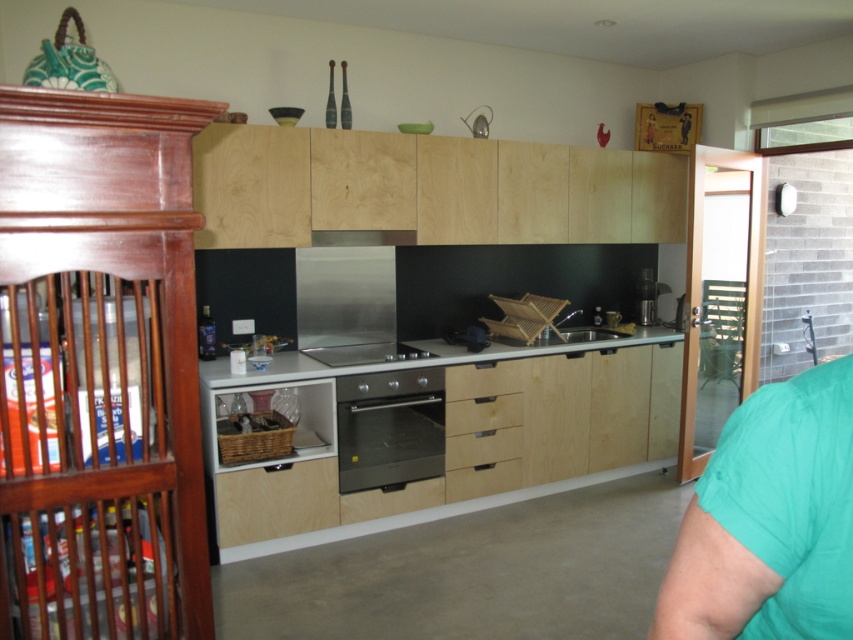
From the picture: Does light wood drawer at center come behind stainless steel stove at center?

Yes, it is.

Is light wood drawer at center in front of stainless steel stove at center?

No, it is not.

Who is more forward, (508, 374) or (399, 355)?

Point (399, 355) is more forward.

At what (x,y) coordinates should I click in order to perform the action: click on light wood drawer at center. Please return your answer as a coordinate pair (x, y). This screenshot has width=853, height=640. Looking at the image, I should click on point(483,380).

Can you confirm if white glossy countertop at center is shorter than stainless steel stove at center?

In fact, white glossy countertop at center may be taller than stainless steel stove at center.

Is white glossy countertop at center positioned behind stainless steel stove at center?

No, it is in front of stainless steel stove at center.

Does point (463, 355) come farther from viewer compared to point (331, 364)?

Yes, point (463, 355) is behind point (331, 364).

Locate an element on the screen. The image size is (853, 640). white glossy countertop at center is located at coordinates (419, 355).

Find the location of a particular element. white glossy countertop at center is located at coordinates (419, 355).

Is white glossy countertop at center positioned in front of light wood drawer at center?

That is True.

Locate an element on the screen. The height and width of the screenshot is (640, 853). white glossy countertop at center is located at coordinates (419, 355).

Locate an element on the screen. The width and height of the screenshot is (853, 640). white glossy countertop at center is located at coordinates click(419, 355).